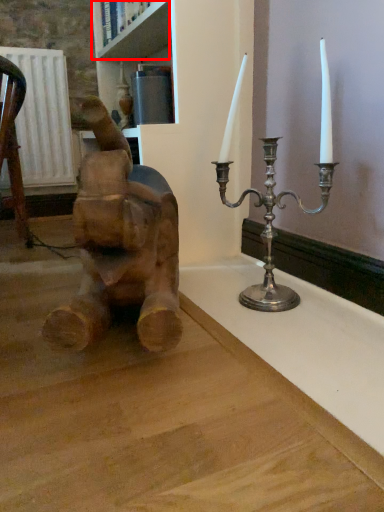
Question: From the image's perspective, considering the relative positions of shelf (annotated by the red box) and statue (sculpture) in the image provided, where is shelf (annotated by the red box) located with respect to the staircase?

Choices:
 (A) below
 (B) above

Answer: (B)